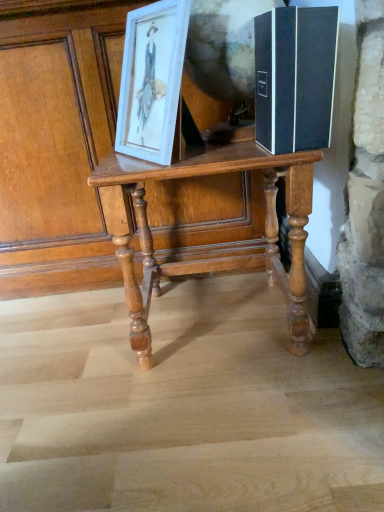
Image resolution: width=384 pixels, height=512 pixels. What are the coordinates of `free space on the front side of wooden table at center` in the screenshot? It's located at tap(219, 422).